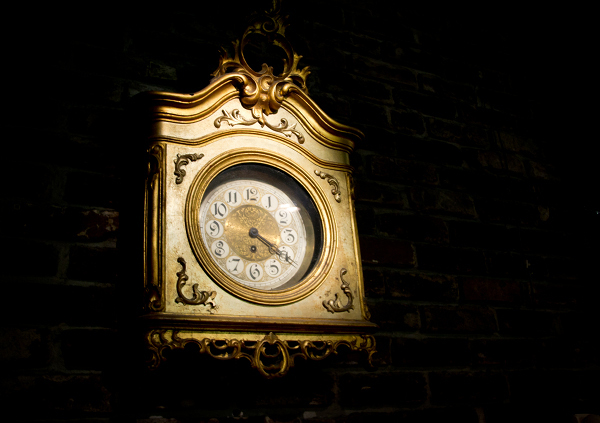
Where is `black ring around clock face`? The height and width of the screenshot is (423, 600). black ring around clock face is located at coordinates (301, 192).